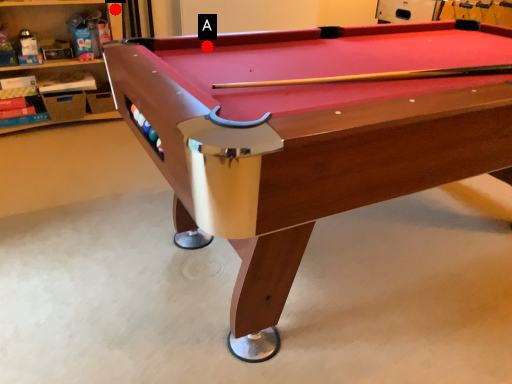
Question: Two points are circled on the image, labeled by A and B beside each circle. Which point is farther from the camera taking this photo?

Choices:
 (A) A is further
 (B) B is further

Answer: (B)